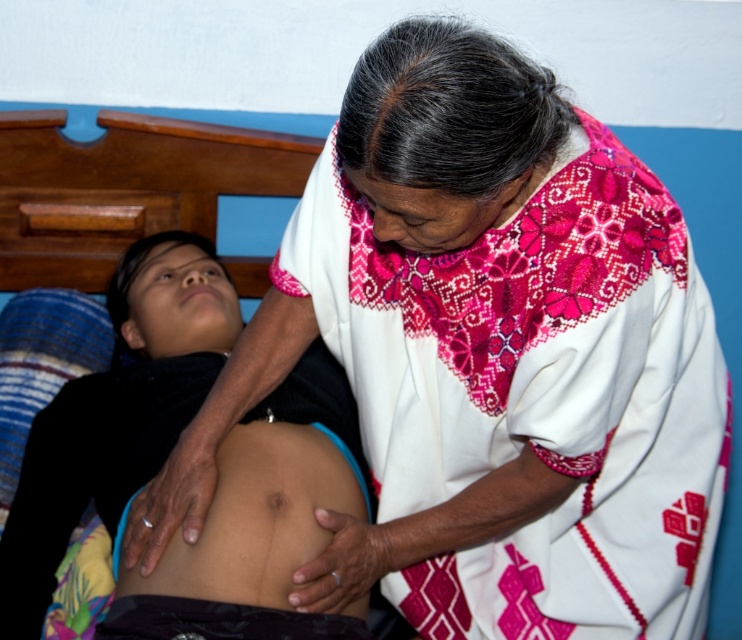
You are a medical student observing a therapy session. You see two people in the scene. The individual lying down has smooth skin at center, and the standing person has skinny white skin at center. Which of the two people is closer to you?

The standing person with skinny white skin at center is closer to you because their skin is closer to the viewer than the smooth skin at center of the lying individual.

You are standing in the room and want to reach the point marked as point (157, 250). If you can move forward 5 feet, will you be able to reach that point?

The distance between you and point (157, 250) is 5.26 feet. Since you can only move forward 5 feet, you will not be able to reach that point.

You are a healthcare professional observing the scene. You need to place a 4 inch long medical tool between the two people at center. Is there enough space between the skinny white skin at center and the smooth skin at center to fit the tool?

The skinny white skin at center is 3.46 inches away from the smooth skin at center. Since the medical tool is 4 inches long, it will not fit between them as the distance is shorter than the tool.